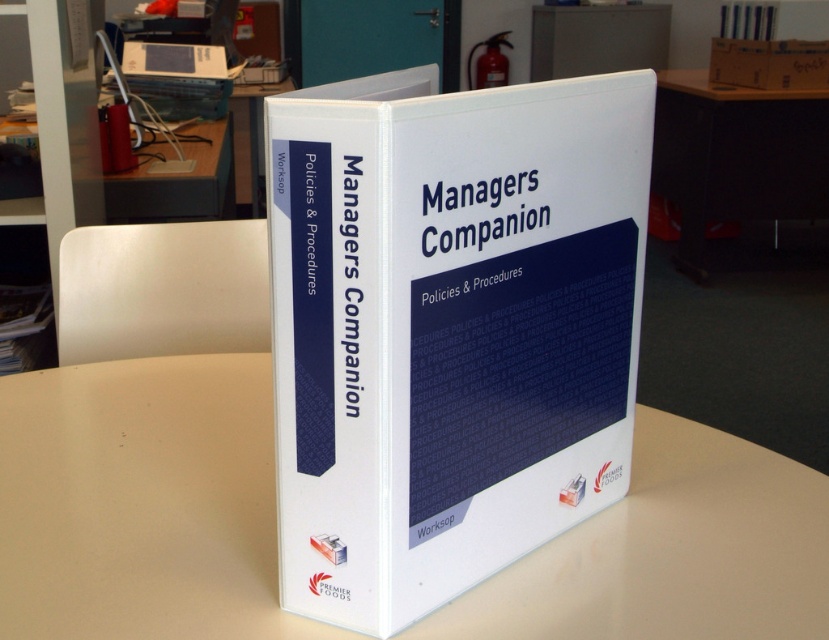
Is white matte binder at center below black plastic table at lower right?

Correct, white matte binder at center is located below black plastic table at lower right.

Is white matte binder at center to the right of black plastic table at lower right from the viewer's perspective?

In fact, white matte binder at center is to the left of black plastic table at lower right.

Identify the location of white matte binder at center. This screenshot has width=829, height=640. click(x=448, y=328).

The height and width of the screenshot is (640, 829). Find the location of `white matte binder at center`. white matte binder at center is located at coordinates (448, 328).

Looking at this image, which of these two, black plastic table at lower right or brown cardboard box at upper right, stands taller?

With more height is black plastic table at lower right.

Is black plastic table at lower right below brown cardboard box at upper right?

Indeed, black plastic table at lower right is positioned under brown cardboard box at upper right.

This screenshot has height=640, width=829. What do you see at coordinates (735, 156) in the screenshot?
I see `black plastic table at lower right` at bounding box center [735, 156].

Find the location of a particular element. Image resolution: width=829 pixels, height=640 pixels. black plastic table at lower right is located at coordinates (735, 156).

Is white plastic bookshelf at lower left thinner than brown cardboard box at upper right?

Yes.

Measure the distance between white plastic bookshelf at lower left and camera.

→ They are 5.42 feet apart.

Who is more distant from viewer, [76,29] or [793,38]?

Point [793,38]

You are a GUI agent. You are given a task and a screenshot of the screen. Output one action in this format:
    pyautogui.click(x=<x>, y=<y>)
    Task: Click on the white plastic bookshelf at lower left
    
    Given the screenshot: What is the action you would take?
    pyautogui.click(x=51, y=163)